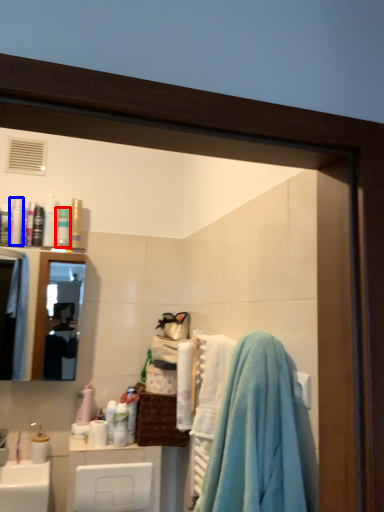
Question: Which point is further to the camera, toiletry (highlighted by a red box) or toiletry (highlighted by a blue box)?

Choices:
 (A) toiletry
 (B) toiletry

Answer: (A)